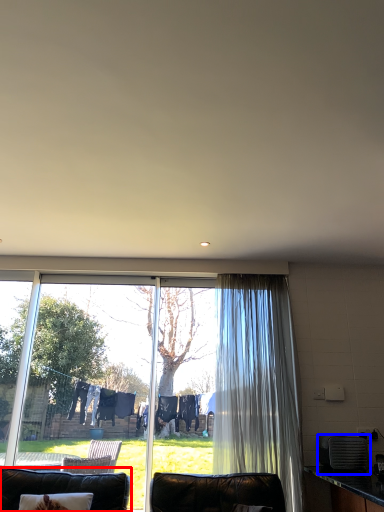
Question: Among these objects, which one is nearest to the camera, furniture (highlighted by a red box) or appliance (highlighted by a blue box)?

Choices:
 (A) furniture
 (B) appliance

Answer: (A)